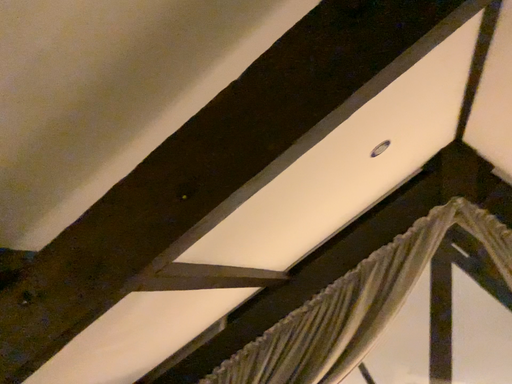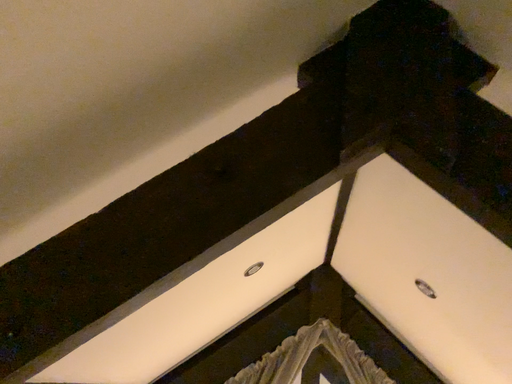
Question: How did the camera likely rotate when shooting the video?

Choices:
 (A) rotated upward
 (B) rotated downward

Answer: (A)